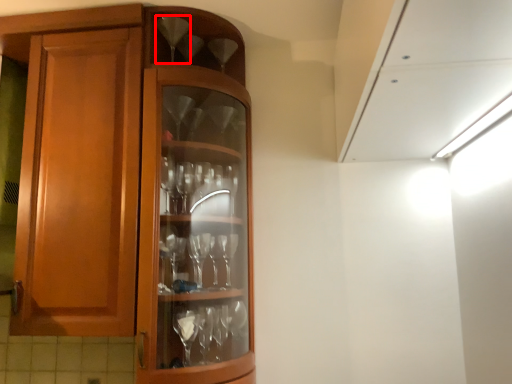
Question: In this image, where is wine glass (annotated by the red box) located relative to wine glass?

Choices:
 (A) right
 (B) left

Answer: (B)